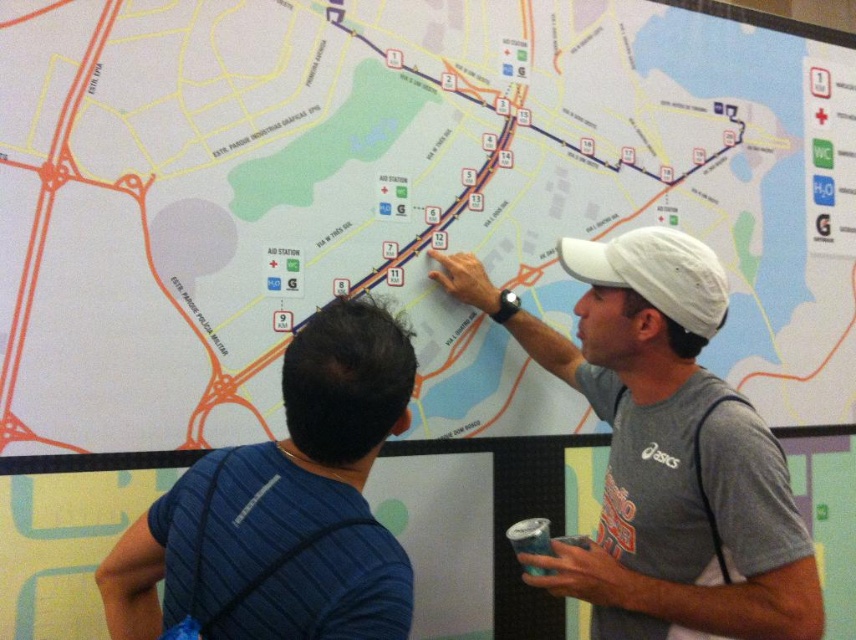
Is white matte map at center closer to camera compared to white matte baseball cap at upper right?

No, white matte map at center is further to the viewer.

Which is behind, point (557, 288) or point (658, 237)?

The point (557, 288) is more distant.

The image size is (856, 640). I want to click on white matte map at center, so click(x=397, y=196).

Does white matte map at center have a greater height compared to gray cotton t-shirt at upper right?

Yes.

Who is taller, white matte map at center or gray cotton t-shirt at upper right?

white matte map at center is taller.

Who is more distant from viewer, (34, 84) or (764, 630)?

Positioned behind is point (34, 84).

This screenshot has width=856, height=640. I want to click on white matte map at center, so click(x=397, y=196).

Between white matte map at center and blue striped shirt at upper left, which one appears on the right side from the viewer's perspective?

Positioned to the right is white matte map at center.

Between point (516, 113) and point (360, 362), which one is positioned behind?

The point (516, 113) is behind.

Does point (510, 26) come closer to viewer compared to point (364, 349)?

That is False.

This screenshot has width=856, height=640. What are the coordinates of `white matte map at center` in the screenshot? It's located at (397, 196).